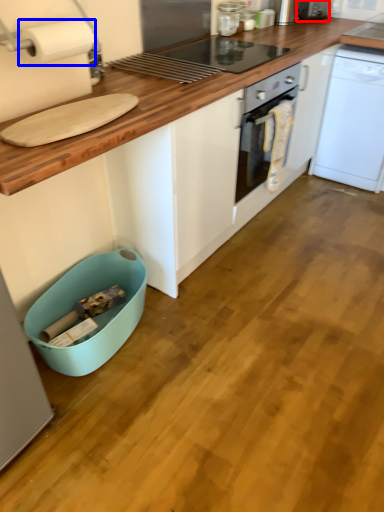
Question: Which of the following is the closest to the observer, appliance (highlighted by a red box) or paper towel (highlighted by a blue box)?

Choices:
 (A) appliance
 (B) paper towel

Answer: (B)